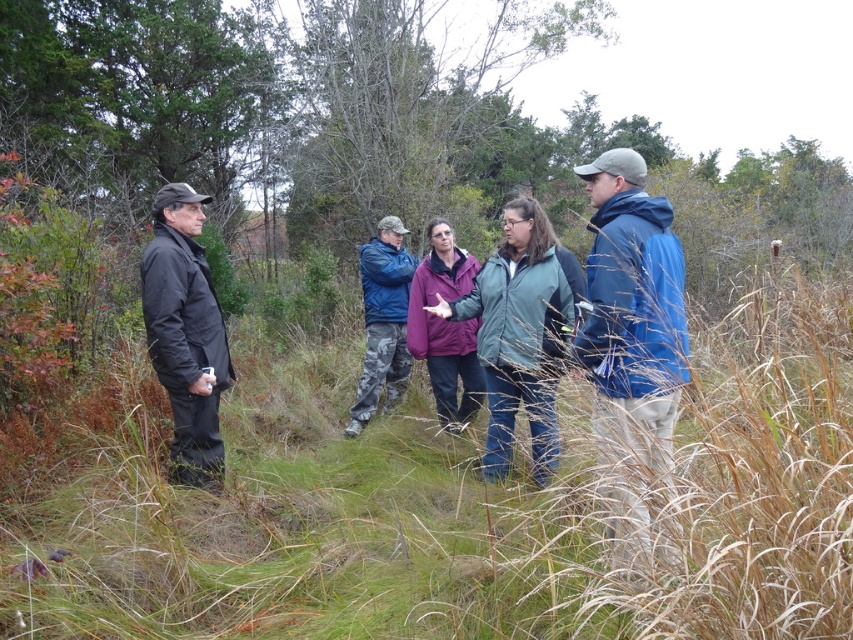
You are a photographer trying to capture a group photo of the five people in the scene. You notice the blue fabric jacket at right and the camo pants at center. To ensure both are fully visible in the frame, which clothing item should you adjust the camera angle to focus on first?

The blue fabric jacket at right is shorter than the camo pants at center, so you should focus on the blue fabric jacket at right first to ensure it is fully visible in the frame.

You are a photographer trying to capture a group photo of the matte purple jacket at center and the purple fleece jacket at center. The camera you are using has a minimum focusing distance of 50 centimeters. Will you be able to take a clear photo of both jackets without moving either of them?

The distance between the matte purple jacket at center and the purple fleece jacket at center is 47.92 centimeters. Since this is less than the camera minimum focusing distance of 50 centimeters, you will not be able to take a clear photo of both jackets without moving them closer together or adjusting the camera settings.

You are organizing a clothing donation drive and need to determine which of the two purple jackets can fit into a standard donation bin that accommodates items up to 20 inches in width. Given that the matte purple jacket at center is wider than the purple fleece jacket at center, can both jackets fit into the bin?

The matte purple jacket at center is wider than the purple fleece jacket at center. Since the donation bin can hold items up to 20 inches wide, both jackets can fit only if the matte purple jacket is under or exactly 20 inches. However, without knowing the exact width of the wider jacket, we can only confirm the purple fleece jacket at center will fit if it meets the width requirement.